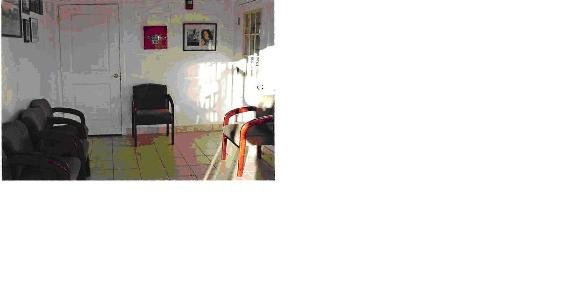
Find the location of a particular element. This screenshot has width=576, height=294. chairs facing to the right is located at coordinates (46, 108), (41, 115), (37, 147).